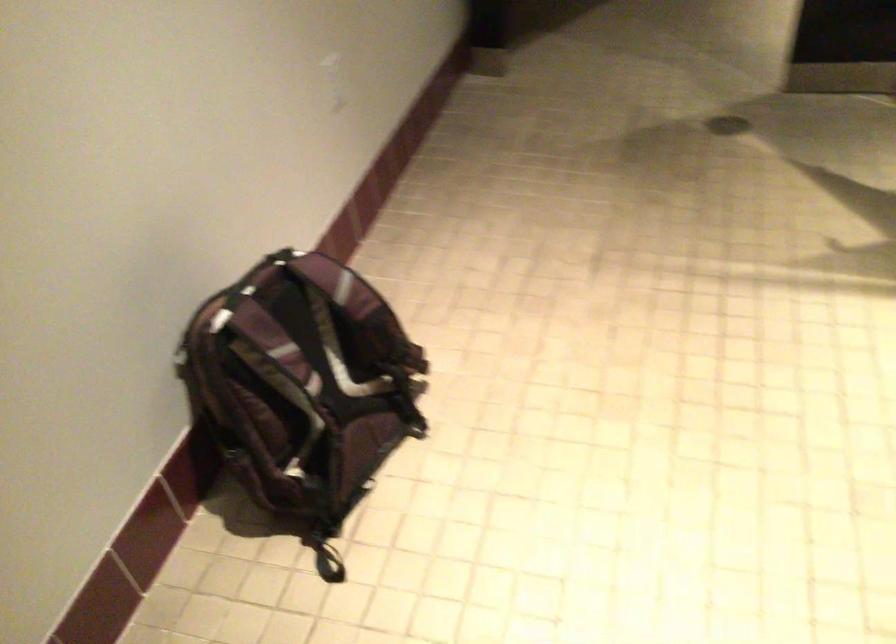
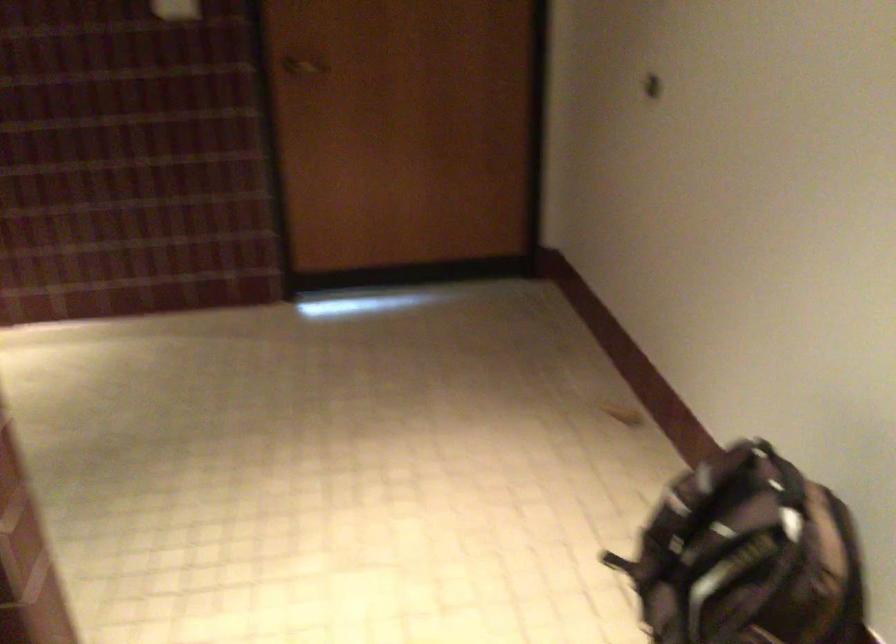
In the second image, find the point that corresponds to point 325,321 in the first image.

(748, 556)